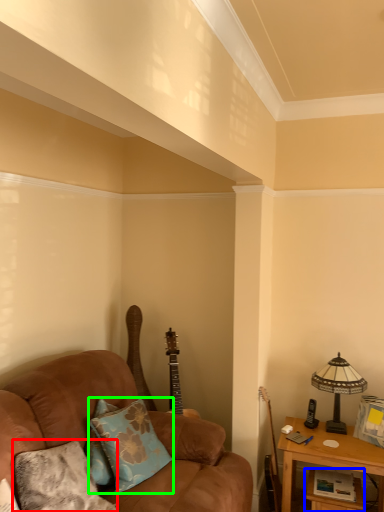
Question: Based on their relative distances, which object is farther from pillow (highlighted by a red box)? Choose from table (highlighted by a blue box) and pillow (highlighted by a green box).

Choices:
 (A) table
 (B) pillow

Answer: (A)